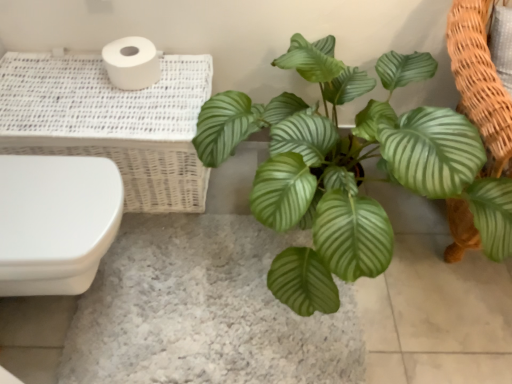
Where is `vacant space that is to the left of white matte toilet paper at upper left`? The image size is (512, 384). vacant space that is to the left of white matte toilet paper at upper left is located at coordinates (78, 76).